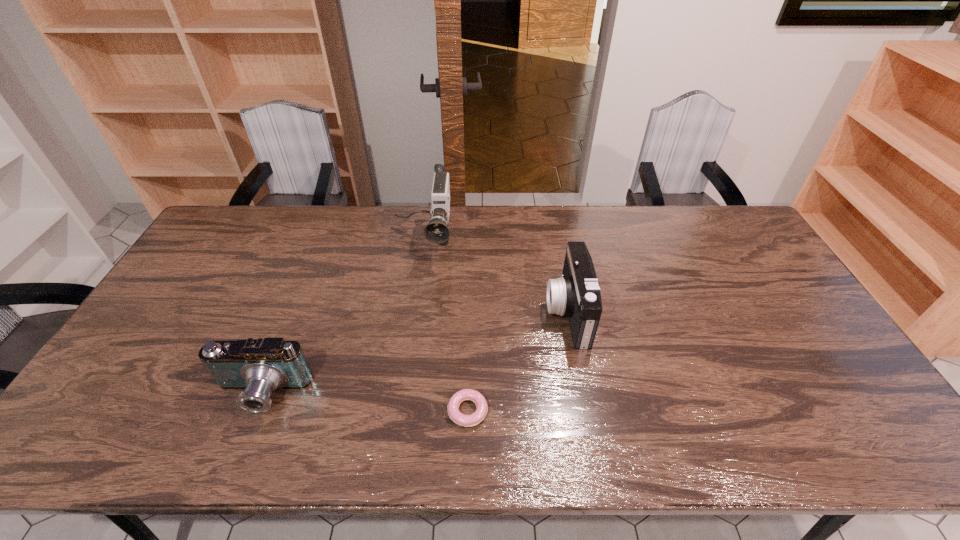
I want to click on the farthest camcorder, so click(436, 231).

Image resolution: width=960 pixels, height=540 pixels. Find the location of `the tallest camcorder`. the tallest camcorder is located at coordinates (436, 231).

Find the location of `the rightmost object`. the rightmost object is located at coordinates [x=577, y=294].

The height and width of the screenshot is (540, 960). Find the location of `the third nearest object`. the third nearest object is located at coordinates (577, 294).

Find the location of a particular element. Image resolution: width=960 pixels, height=540 pixels. the leftmost object is located at coordinates (260, 366).

Locate an element on the screen. the leftmost camcorder is located at coordinates 260,366.

Where is `doughnut`? doughnut is located at coordinates coord(455,415).

The image size is (960, 540). Identify the location of the second object from right to left. (455, 415).

Find the location of a particular element. This screenshot has height=540, width=960. free space located 0.340m on the recording direction of the tallest camcorder is located at coordinates (408, 356).

This screenshot has height=540, width=960. Identify the location of free region located 0.340m on the lens of the second tallest camcorder. (431, 312).